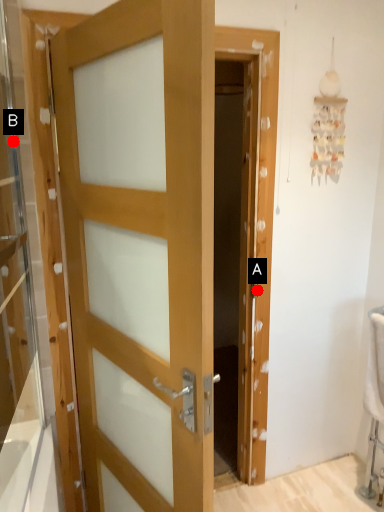
Question: Two points are circled on the image, labeled by A and B beside each circle. Which point appears closest to the camera in this image?

Choices:
 (A) A is closer
 (B) B is closer

Answer: (B)